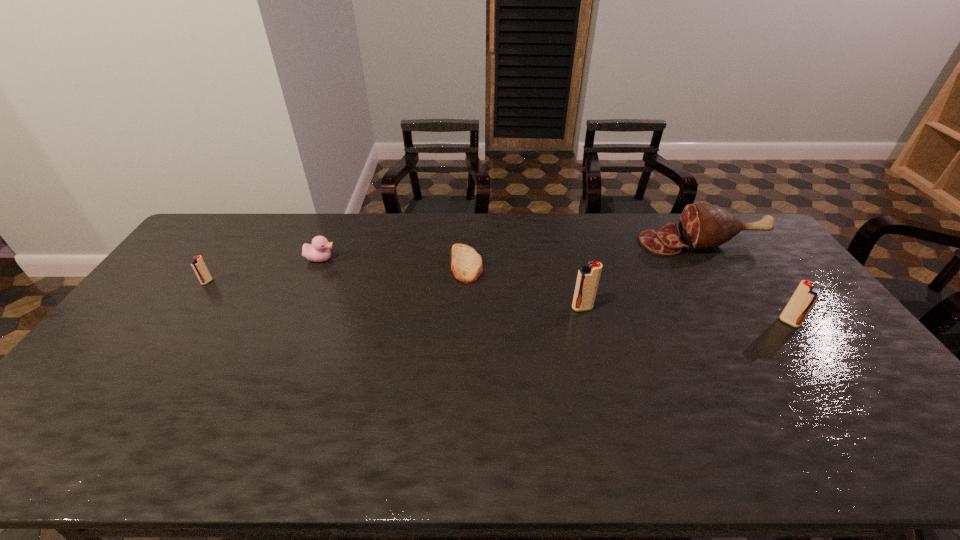
The image size is (960, 540). Find the location of `unoccupied area between the nearest object and the fourth object from right to left`. unoccupied area between the nearest object and the fourth object from right to left is located at coordinates (628, 293).

Locate an element on the screen. This screenshot has width=960, height=540. vacant space in between the ham and the rightmost igniter is located at coordinates (745, 282).

In order to click on free space between the pita bread and the duckling in this screenshot , I will do `click(394, 262)`.

Identify the location of vacant space that's between the leftmost object and the fifth object from right to left. The height and width of the screenshot is (540, 960). (264, 271).

Locate an element on the screen. This screenshot has width=960, height=540. free spot between the duckling and the ham is located at coordinates (512, 251).

The width and height of the screenshot is (960, 540). I want to click on free point between the rightmost igniter and the shortest object, so click(628, 293).

Locate an element on the screen. Image resolution: width=960 pixels, height=540 pixels. vacant area that lies between the leftmost igniter and the duckling is located at coordinates (264, 271).

At what (x,y) coordinates should I click in order to perform the action: click on object that is the third closest one to the shortest igniter. Please return your answer as a coordinate pair (x, y). This screenshot has height=540, width=960. Looking at the image, I should click on (588, 277).

At what (x,y) coordinates should I click in order to perform the action: click on object that can be found as the third closest to the second object from left to right. Please return your answer as a coordinate pair (x, y). The width and height of the screenshot is (960, 540). Looking at the image, I should click on (588, 277).

I want to click on the third closest igniter to the second object from left to right, so pos(805,296).